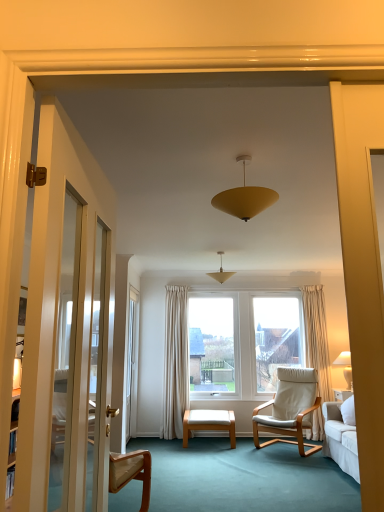
Question: Considering the relative sizes of white glossy screen door at left and matte yellow cone at center in the image provided, is white glossy screen door at left shorter than matte yellow cone at center?

Choices:
 (A) yes
 (B) no

Answer: (B)

Question: Does white glossy screen door at left appear on the left side of matte yellow cone at center?

Choices:
 (A) yes
 (B) no

Answer: (A)

Question: Would you say white glossy screen door at left is outside matte yellow cone at center?

Choices:
 (A) no
 (B) yes

Answer: (B)

Question: Can you confirm if white glossy screen door at left is taller than matte yellow cone at center?

Choices:
 (A) yes
 (B) no

Answer: (A)

Question: Is white glossy screen door at left smaller than matte yellow cone at center?

Choices:
 (A) yes
 (B) no

Answer: (B)

Question: Would you say matte yellow cone at center is inside or outside white fabric chair at center?

Choices:
 (A) inside
 (B) outside

Answer: (B)

Question: In the image, is matte yellow cone at center positioned in front of or behind white fabric chair at center?

Choices:
 (A) front
 (B) behind

Answer: (A)

Question: Is matte yellow cone at center wider or thinner than white fabric chair at center?

Choices:
 (A) thin
 (B) wide

Answer: (A)

Question: From the image's perspective, is matte yellow cone at center above or below white fabric chair at center?

Choices:
 (A) below
 (B) above

Answer: (B)

Question: In the image, is white wood stool at center on the left side or the right side of matte yellow cone at center?

Choices:
 (A) right
 (B) left

Answer: (B)

Question: Is point (188, 421) closer or farther from the camera than point (258, 197)?

Choices:
 (A) closer
 (B) farther

Answer: (B)

Question: Considering their positions, is white wood stool at center located in front of or behind matte yellow cone at center?

Choices:
 (A) front
 (B) behind

Answer: (B)

Question: Is white wood stool at center taller or shorter than matte yellow cone at center?

Choices:
 (A) short
 (B) tall

Answer: (A)

Question: Choose the correct answer: Is matte yellow cone at center inside matte yellow cone at center or outside it?

Choices:
 (A) outside
 (B) inside

Answer: (A)

Question: In the image, is matte yellow cone at center on the left side or the right side of matte yellow cone at center?

Choices:
 (A) right
 (B) left

Answer: (B)